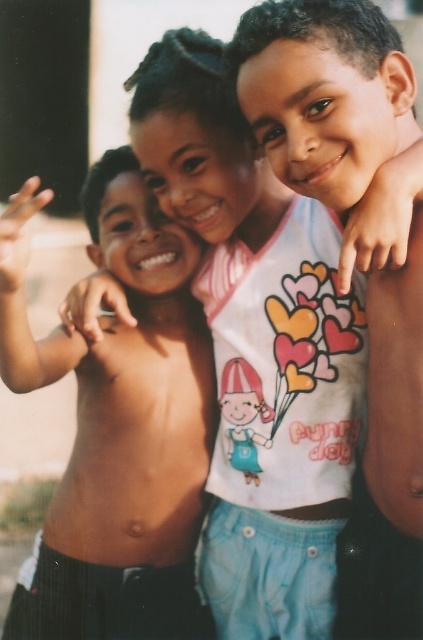
Is shiny skin at left taller than smooth skin boy at center?

Correct, shiny skin at left is much taller as smooth skin boy at center.

Does point (10, 202) come closer to viewer compared to point (329, 3)?

Yes, it is in front of point (329, 3).

Find the location of a particular element. Image resolution: width=423 pixels, height=640 pixels. shiny skin at left is located at coordinates (118, 426).